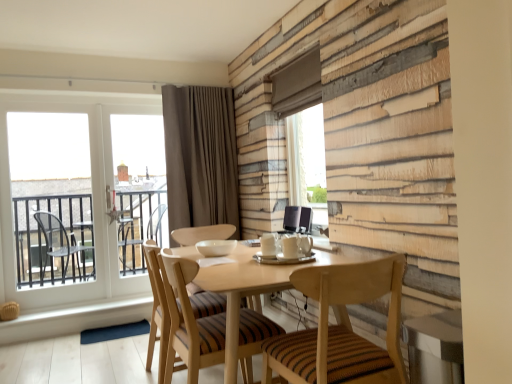
Measure the distance between brown velvet curtain at upper center and camera.

12.79 feet.

What do you see at coordinates (307, 161) in the screenshot? I see `transparent glass window screen at upper center, the 2th window screen viewed from the back` at bounding box center [307, 161].

The height and width of the screenshot is (384, 512). In order to click on transparent glass door at left, which is the second window screen from front to back in this screenshot , I will do `click(51, 198)`.

What is the approximate width of transparent glass door at left, which ranks as the second window screen in right-to-left order?

transparent glass door at left, which ranks as the second window screen in right-to-left order, is 1.81 inches wide.

What are the coordinates of `light wood textured chair at center, which is the 2th chair from right to left` in the screenshot? It's located at (188, 317).

This screenshot has height=384, width=512. Find the location of `wooden striped chair at center, acting as the 1th chair starting from the right`. wooden striped chair at center, acting as the 1th chair starting from the right is located at coordinates (341, 328).

Which of these two, transparent glass door at left, which ranks as the second window screen in right-to-left order, or brown velvet curtain at upper center, is thinner?

transparent glass door at left, which ranks as the second window screen in right-to-left order, is thinner.

In terms of height, does transparent glass door at left, which is the first window screen in left-to-right order, look taller or shorter compared to brown velvet curtain at upper center?

transparent glass door at left, which is the first window screen in left-to-right order, is taller than brown velvet curtain at upper center.

You are a GUI agent. You are given a task and a screenshot of the screen. Output one action in this format:
    pyautogui.click(x=<x>, y=<y>)
    Task: Click on the curtain on the right of transparent glass door at left, which is the second window screen from front to back
    This screenshot has height=384, width=512.
    Given the screenshot: What is the action you would take?
    pyautogui.click(x=200, y=157)

From a real-world perspective, is transparent glass door at left, which is the first window screen in left-to-right order, physically below brown velvet curtain at upper center?

Yes, from a real-world perspective, transparent glass door at left, which is the first window screen in left-to-right order, is under brown velvet curtain at upper center.

Looking at this image, what's the angular difference between transparent glass window screen at upper center, the 1th window screen from the right, and brown velvet curtain at upper center's facing directions?

transparent glass window screen at upper center, the 1th window screen from the right, and brown velvet curtain at upper center are facing 82.6 degrees away from each other.

Is transparent glass window screen at upper center, the 2th window screen viewed from the back, at the right side of brown velvet curtain at upper center?

Yes, transparent glass window screen at upper center, the 2th window screen viewed from the back, is to the right of brown velvet curtain at upper center.

From the picture: Is brown velvet curtain at upper center located within transparent glass window screen at upper center, the 1th window screen from the front?

No, brown velvet curtain at upper center is not surrounded by transparent glass window screen at upper center, the 1th window screen from the front.

From a real-world perspective, is transparent glass window screen at upper center, arranged as the second window screen when viewed from the left, physically above brown velvet curtain at upper center?

Incorrect, from a real-world perspective, transparent glass window screen at upper center, arranged as the second window screen when viewed from the left, is lower than brown velvet curtain at upper center.

Which of these two, transparent glass door at left, which is the first window screen in left-to-right order, or light wood textured chair at center, arranged as the first chair when viewed from the left, is bigger?

light wood textured chair at center, arranged as the first chair when viewed from the left.

Is transparent glass door at left, which is the second window screen from front to back, in front of light wood textured chair at center, arranged as the first chair when viewed from the left?

No, transparent glass door at left, which is the second window screen from front to back, is behind light wood textured chair at center, arranged as the first chair when viewed from the left.

Starting from the transparent glass door at left, which ranks as the second window screen in right-to-left order, which chair is the 1st one in front? Please provide its 2D coordinates.

[(188, 317)]

How different are the orientations of transparent glass door at left, which is the first window screen in left-to-right order, and light wood textured chair at center, arranged as the first chair when viewed from the left, in degrees?

The angular difference between transparent glass door at left, which is the first window screen in left-to-right order, and light wood textured chair at center, arranged as the first chair when viewed from the left, is 91.2 degrees.

Find the location of a particular element. The width and height of the screenshot is (512, 384). the 1st window screen positioned below the brown velvet curtain at upper center (from the image's perspective) is located at coordinates (307, 161).

Between brown velvet curtain at upper center and transparent glass window screen at upper center, the 1th window screen from the right, which one has larger width?

Wider between the two is brown velvet curtain at upper center.

Considering the positions of objects brown velvet curtain at upper center and transparent glass window screen at upper center, the 1th window screen from the front, in the image provided, who is more to the left, brown velvet curtain at upper center or transparent glass window screen at upper center, the 1th window screen from the front,?

From the viewer's perspective, brown velvet curtain at upper center appears more on the left side.

From the image's perspective, which is above, brown velvet curtain at upper center or transparent glass window screen at upper center, the 1th window screen from the front?

brown velvet curtain at upper center is shown above in the image.

Between transparent glass door at left, which is the second window screen from front to back, and white glass window at left, which one has larger width?

transparent glass door at left, which is the second window screen from front to back, is wider.

Is transparent glass door at left, which ranks as the first window screen in back-to-front order, with white glass window at left?

There is a gap between transparent glass door at left, which ranks as the first window screen in back-to-front order, and white glass window at left.

Which is less distant, [42,201] or [10,103]?

The point [10,103] is more forward.

From the image's perspective, would you say transparent glass door at left, which ranks as the second window screen in right-to-left order, is positioned over transparent glass window screen at upper center, the 1th window screen from the right?

No, from the image's perspective, transparent glass door at left, which ranks as the second window screen in right-to-left order, is not on top of transparent glass window screen at upper center, the 1th window screen from the right.

How much distance is there between transparent glass door at left, which is the second window screen from front to back, and transparent glass window screen at upper center, the 1th window screen from the front?

They are 2.10 meters apart.

Which is closer to the camera, (44,261) or (290,195)?

Point (44,261) is positioned farther from the camera compared to point (290,195).

Is transparent glass door at left, which ranks as the second window screen in right-to-left order, wider than transparent glass window screen at upper center, the 2th window screen viewed from the back?

No, transparent glass door at left, which ranks as the second window screen in right-to-left order, is not wider than transparent glass window screen at upper center, the 2th window screen viewed from the back.

From the picture: Does brown velvet curtain at upper center touch light wood textured chair at center, arranged as the first chair when viewed from the left?

No, brown velvet curtain at upper center is not in contact with light wood textured chair at center, arranged as the first chair when viewed from the left.

Who is shorter, brown velvet curtain at upper center or light wood textured chair at center, arranged as the first chair when viewed from the left?

With less height is light wood textured chair at center, arranged as the first chair when viewed from the left.

From the image's perspective, is brown velvet curtain at upper center over light wood textured chair at center, which is the 2th chair from right to left?

Yes, from the image's perspective, brown velvet curtain at upper center is above light wood textured chair at center, which is the 2th chair from right to left.

Is brown velvet curtain at upper center wider or thinner than light wood textured chair at center, arranged as the first chair when viewed from the left?

brown velvet curtain at upper center is thinner than light wood textured chair at center, arranged as the first chair when viewed from the left.

Identify the location of curtain above the transparent glass door at left, which ranks as the second window screen in right-to-left order (from the image's perspective). Image resolution: width=512 pixels, height=384 pixels. (200, 157).

The height and width of the screenshot is (384, 512). I want to click on window screen on the right of the brown velvet curtain at upper center, so click(307, 161).

From the image, which object appears to be nearer to transparent glass window screen at upper center, the 2th window screen viewed from the back, light wood textured chair at center, which is the 2th chair from right to left, or white glass window at left?

light wood textured chair at center, which is the 2th chair from right to left, is closer to transparent glass window screen at upper center, the 2th window screen viewed from the back.

When comparing their distances from brown velvet curtain at upper center, does light wood textured chair at center, which is the 2th chair from right to left, or transparent glass door at left, which ranks as the second window screen in right-to-left order, seem further?

light wood textured chair at center, which is the 2th chair from right to left, is further to brown velvet curtain at upper center.

Based on their spatial positions, is light wood textured chair at center, arranged as the first chair when viewed from the left, or white glass window at left further from transparent glass door at left, which is the second window screen from front to back?

light wood textured chair at center, arranged as the first chair when viewed from the left.

When comparing their distances from light wood textured chair at center, which is the 2th chair from right to left, does white glass window at left or transparent glass window screen at upper center, the 1th window screen from the right, seem closer?

transparent glass window screen at upper center, the 1th window screen from the right, lies closer to light wood textured chair at center, which is the 2th chair from right to left, than the other object.

When comparing their distances from white glass window at left, does transparent glass window screen at upper center, the 1th window screen from the right, or wooden striped chair at center, the second chair viewed from the left, seem closer?

Among the two, transparent glass window screen at upper center, the 1th window screen from the right, is located nearer to white glass window at left.

Looking at the image, which one is located further to transparent glass door at left, which ranks as the first window screen in back-to-front order, wooden striped chair at center, acting as the 1th chair starting from the right, or transparent glass window screen at upper center, the 1th window screen from the right?

wooden striped chair at center, acting as the 1th chair starting from the right.

From the image, which object appears to be farther from transparent glass door at left, which ranks as the second window screen in right-to-left order, wooden striped chair at center, the second chair viewed from the left, or brown velvet curtain at upper center?

wooden striped chair at center, the second chair viewed from the left, lies further to transparent glass door at left, which ranks as the second window screen in right-to-left order, than the other object.

Looking at the image, which one is located closer to white glass window at left, transparent glass window screen at upper center, the 2th window screen viewed from the back, or light wood textured chair at center, which is the 2th chair from right to left?

transparent glass window screen at upper center, the 2th window screen viewed from the back, lies closer to white glass window at left than the other object.

Identify the location of chair located between wooden striped chair at center, the second chair viewed from the left, and white glass window at left in the depth direction. The image size is (512, 384). (188, 317).

The height and width of the screenshot is (384, 512). I want to click on window located between wooden striped chair at center, acting as the 1th chair starting from the right, and brown velvet curtain at upper center in the depth direction, so click(91, 195).

The height and width of the screenshot is (384, 512). What are the coordinates of `window located between transparent glass door at left, which is the first window screen in left-to-right order, and transparent glass window screen at upper center, the 2th window screen viewed from the back, in the left-right direction` in the screenshot? It's located at (91, 195).

Where is `chair between wooden striped chair at center, acting as the 1th chair starting from the right, and brown velvet curtain at upper center in the front-back direction`? The height and width of the screenshot is (384, 512). chair between wooden striped chair at center, acting as the 1th chair starting from the right, and brown velvet curtain at upper center in the front-back direction is located at coordinates (188, 317).